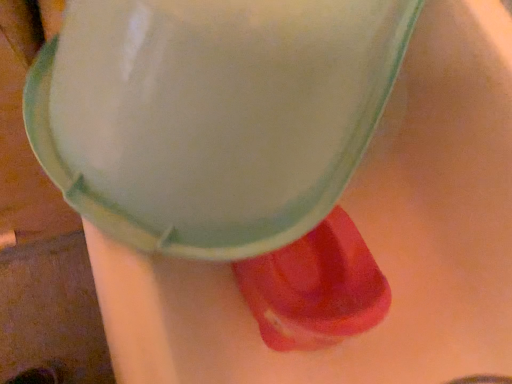
I want to click on rubberized red shoe at lower right, so [x=315, y=288].

What do you see at coordinates (315, 288) in the screenshot? I see `rubberized red shoe at lower right` at bounding box center [315, 288].

What do you see at coordinates (212, 115) in the screenshot? I see `matte white foam at center` at bounding box center [212, 115].

Image resolution: width=512 pixels, height=384 pixels. What are the coordinates of `matte white foam at center` in the screenshot? It's located at (212, 115).

In order to click on rubberized red shoe at lower right in this screenshot , I will do `click(315, 288)`.

Is matte white foam at center at the left side of rubberized red shoe at lower right?

Yes, matte white foam at center is to the left of rubberized red shoe at lower right.

Is matte white foam at center closer to the viewer compared to rubberized red shoe at lower right?

Yes, it is in front of rubberized red shoe at lower right.

Between point (317, 175) and point (336, 238), which one is positioned behind?

The point (336, 238) is farther.

From the image's perspective, relative to rubberized red shoe at lower right, is matte white foam at center above or below?

matte white foam at center is above rubberized red shoe at lower right.

From a real-world perspective, is matte white foam at center on rubberized red shoe at lower right?

Indeed, from a real-world perspective, matte white foam at center stands above rubberized red shoe at lower right.

Does matte white foam at center have a lesser width compared to rubberized red shoe at lower right?

No.

Is matte white foam at center shorter than rubberized red shoe at lower right?

No, matte white foam at center is not shorter than rubberized red shoe at lower right.

Can you confirm if matte white foam at center is bigger than rubberized red shoe at lower right?

Yes.

Is matte white foam at center not inside rubberized red shoe at lower right?

matte white foam at center lies outside rubberized red shoe at lower right's area.

Is matte white foam at center far from rubberized red shoe at lower right?

No, matte white foam at center is not far from rubberized red shoe at lower right.

Could you tell me if matte white foam at center is turned towards rubberized red shoe at lower right?

No, matte white foam at center is not oriented towards rubberized red shoe at lower right.

How much distance is there between matte white foam at center and rubberized red shoe at lower right?

matte white foam at center and rubberized red shoe at lower right are 12.52 inches apart from each other.

Image resolution: width=512 pixels, height=384 pixels. Identify the location of footwear behind the matte white foam at center. (315, 288).

Which object is positioned more to the left, rubberized red shoe at lower right or matte white foam at center?

matte white foam at center.

Consider the image. Which object is closer to the camera taking this photo, rubberized red shoe at lower right or matte white foam at center?

Positioned in front is matte white foam at center.

Does point (338, 253) appear closer or farther from the camera than point (61, 87)?

Point (338, 253).

From the image's perspective, which is above, rubberized red shoe at lower right or matte white foam at center?

matte white foam at center appears higher in the image.

From a real-world perspective, is rubberized red shoe at lower right located beneath matte white foam at center?

Indeed, from a real-world perspective, rubberized red shoe at lower right is positioned beneath matte white foam at center.

Considering the sizes of objects rubberized red shoe at lower right and matte white foam at center in the image provided, who is wider, rubberized red shoe at lower right or matte white foam at center?

Wider between the two is matte white foam at center.

Considering the sizes of objects rubberized red shoe at lower right and matte white foam at center in the image provided, who is taller, rubberized red shoe at lower right or matte white foam at center?

matte white foam at center is taller.

Which of these two, rubberized red shoe at lower right or matte white foam at center, is smaller?

rubberized red shoe at lower right.

Is rubberized red shoe at lower right surrounding matte white foam at center?

No.

Is rubberized red shoe at lower right far from matte white foam at center?

rubberized red shoe at lower right is near matte white foam at center, not far away.

Could you tell me if rubberized red shoe at lower right is facing matte white foam at center?

No.

How different are the orientations of rubberized red shoe at lower right and matte white foam at center in degrees?

52.6 degrees separate the facing orientations of rubberized red shoe at lower right and matte white foam at center.

Measure the distance between rubberized red shoe at lower right and matte white foam at center.

rubberized red shoe at lower right and matte white foam at center are 12.52 inches apart from each other.

Find the location of `footwear directly beneath the matte white foam at center (from a real-world perspective)`. footwear directly beneath the matte white foam at center (from a real-world perspective) is located at coordinates (315, 288).

Locate an element on the screen. The height and width of the screenshot is (384, 512). foam above the rubberized red shoe at lower right (from the image's perspective) is located at coordinates (212, 115).

Locate an element on the screen. The height and width of the screenshot is (384, 512). foam that appears on the left of rubberized red shoe at lower right is located at coordinates (212, 115).